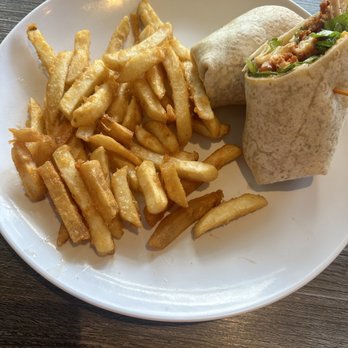
The image size is (348, 348). What are the coordinates of `wood grain` in the screenshot? It's located at (341, 281), (331, 309), (322, 327), (286, 343).